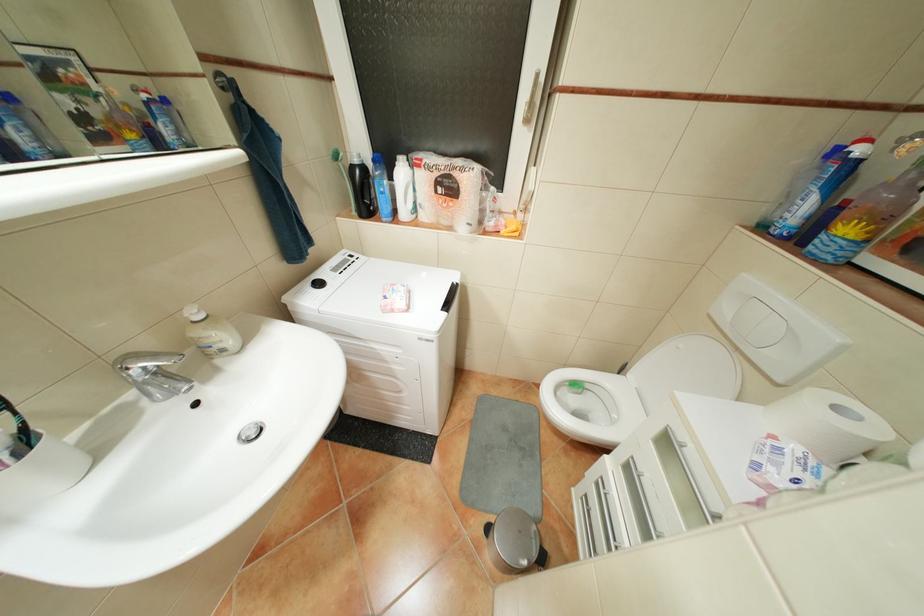
You are a GUI agent. You are given a task and a screenshot of the screen. Output one action in this format:
    pyautogui.click(x=<x>, y=<y>)
    Task: Click on the washing machine handle
    
    Given the screenshot: What is the action you would take?
    pyautogui.click(x=450, y=297)